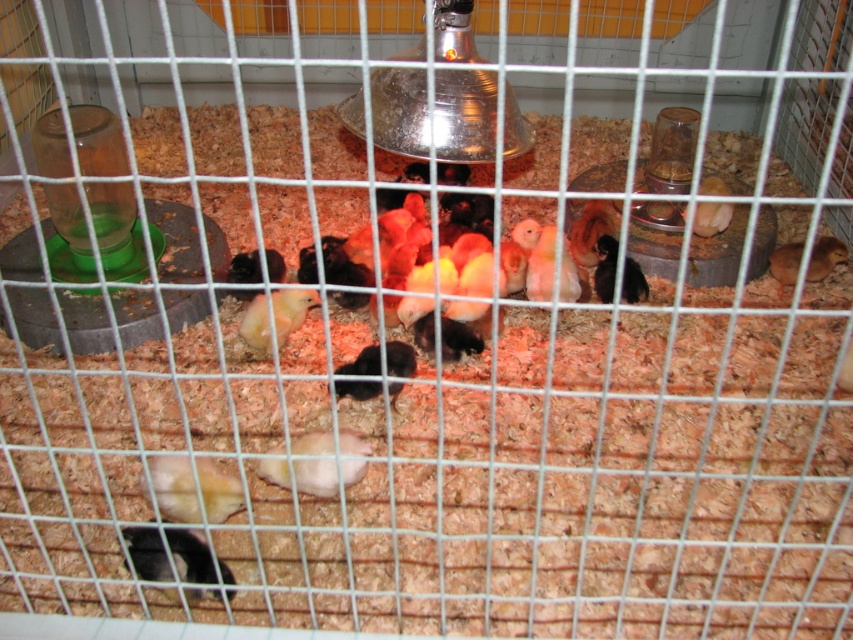
Question: Can you confirm if yellow fluffy chick at lower left is positioned to the left of brown fluffy chick at upper right?

Choices:
 (A) yes
 (B) no

Answer: (A)

Question: Which object is closer to the camera taking this photo?

Choices:
 (A) brown fuzzy chick at right
 (B) yellow matte chick at center
 (C) brown fluffy chick at upper right
 (D) black fur rabbit at lower left

Answer: (D)

Question: Among these points, which one is nearest to the camera?

Choices:
 (A) (161, 544)
 (B) (349, 467)

Answer: (A)

Question: Does yellow fluffy chick at lower left appear on the right side of white matte chicken at center?

Choices:
 (A) no
 (B) yes

Answer: (A)

Question: Is orange fluffy chick at center below yellow matte chick at center?

Choices:
 (A) no
 (B) yes

Answer: (A)

Question: Which of the following is the farthest from the observer?

Choices:
 (A) (201, 572)
 (B) (341, 435)

Answer: (B)